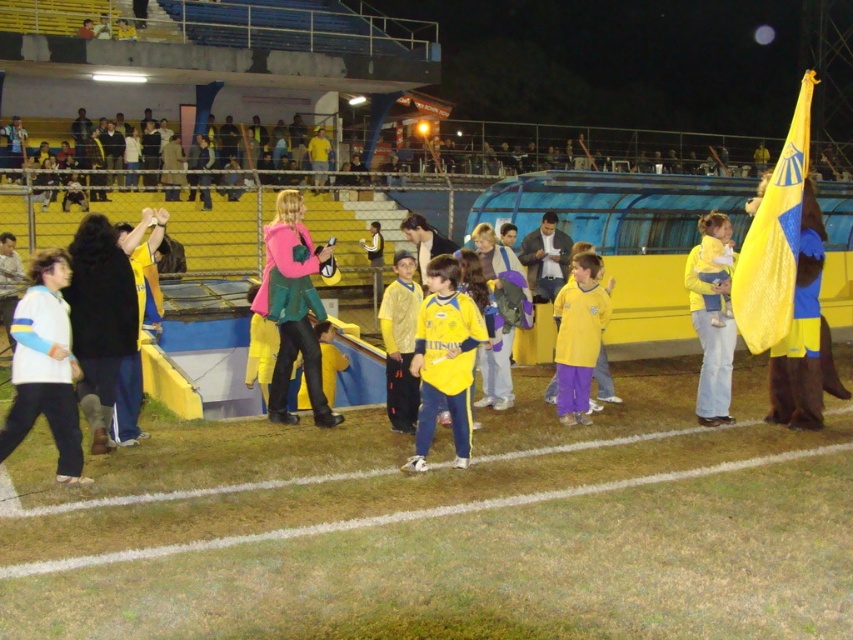
Question: Which is farther from the yellow fabric flag at right?

Choices:
 (A) pink fabric jacket at center
 (B) yellow jersey at center
 (C) white fleece jacket at lower left

Answer: (C)

Question: Which point is closer to the camera?

Choices:
 (A) white fleece jacket at lower left
 (B) pink fabric jacket at center

Answer: (A)

Question: Estimate the real-world distances between objects in this image. Which object is closer to the pink fabric jacket at center?

Choices:
 (A) white fleece jacket at lower left
 (B) yellow fabric flag at right

Answer: (A)

Question: Can you confirm if white fleece jacket at lower left is positioned below yellow jersey at center?

Choices:
 (A) yes
 (B) no

Answer: (B)

Question: Is yellow jersey at center thinner than yellow fabric flag at right?

Choices:
 (A) yes
 (B) no

Answer: (B)

Question: Can you confirm if white fleece jacket at lower left is wider than yellow jersey at center?

Choices:
 (A) yes
 (B) no

Answer: (B)